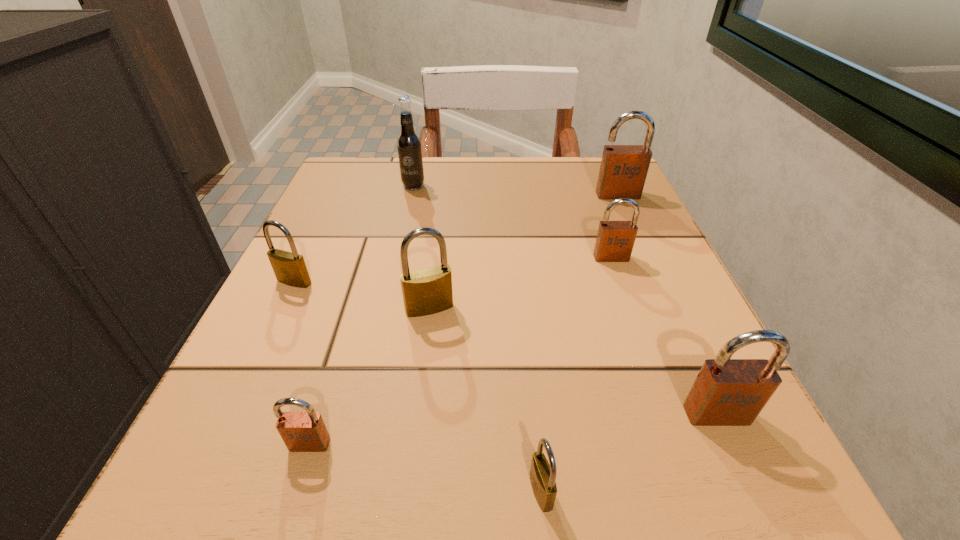
The image size is (960, 540). In the image, there is a desktop. What are the coordinates of `free region at the left edge` in the screenshot? It's located at (328, 303).

In the image, there is a desktop. Where is `vacant space at the right edge`? The height and width of the screenshot is (540, 960). vacant space at the right edge is located at coordinates (619, 336).

Locate an element on the screen. free space at the far left corner of the desktop is located at coordinates (376, 174).

Where is `empty space between the leftmost object and the sixth nearest padlock`? empty space between the leftmost object and the sixth nearest padlock is located at coordinates (453, 269).

What are the coordinates of `free space between the third object from left to right and the fifth object from right to left` in the screenshot? It's located at (421, 247).

Identify the location of vacant space that is in between the fourth farthest object and the second nearest brass padlock. (362, 295).

Where is `vacant space that is in between the fifth object from right to left and the second object from left to right`? vacant space that is in between the fifth object from right to left and the second object from left to right is located at coordinates pyautogui.click(x=370, y=376).

This screenshot has width=960, height=540. Identify the location of unoccupied area between the fourth farthest object and the smallest brown padlock. (302, 363).

Identify the location of unoccupied position between the third farthest object and the smallest brown padlock. This screenshot has width=960, height=540. (461, 351).

Locate an element on the screen. This screenshot has height=540, width=960. vacant space that is in between the third padlock from left to right and the leftmost object is located at coordinates (362, 295).